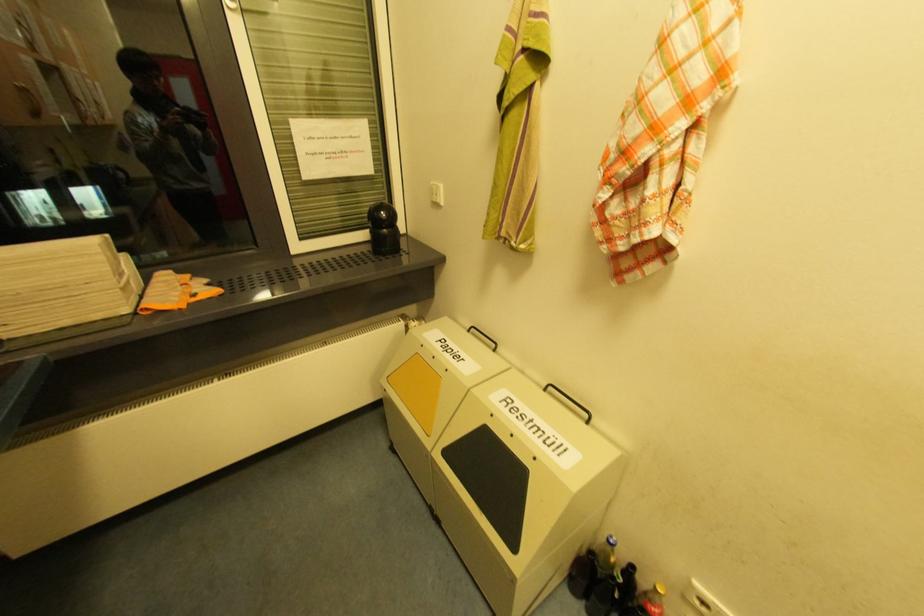
The width and height of the screenshot is (924, 616). I want to click on dark glass bottle, so (625, 589).